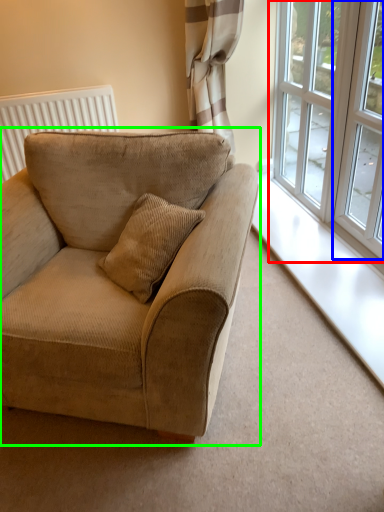
Question: Which object is positioned farthest from window (highlighted by a red box)? Select from window (highlighted by a blue box) and studio couch (highlighted by a green box).

Choices:
 (A) window
 (B) studio couch

Answer: (B)